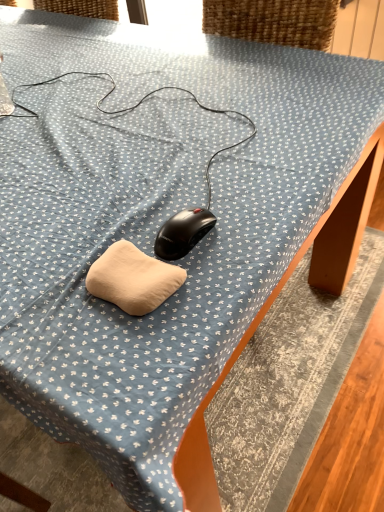
Question: Should I look upward or downward to see beige fabric pillow at center?

Choices:
 (A) up
 (B) down

Answer: (B)